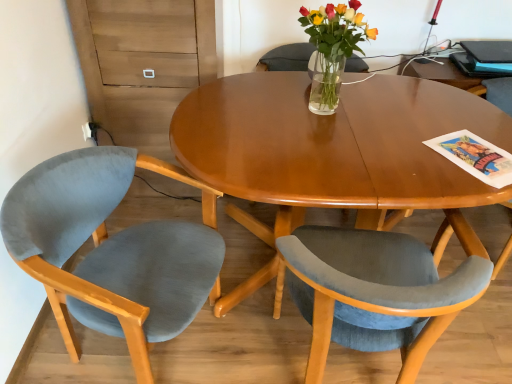
Question: Based on their sizes in the image, would you say velvet blue chair at center, which appears as the second chair when viewed from the left, is bigger or smaller than blue glossy magazine at upper right?

Choices:
 (A) small
 (B) big

Answer: (B)

Question: Is velvet blue chair at center, which ranks as the second chair in right-to-left order, inside the boundaries of blue glossy magazine at upper right, or outside?

Choices:
 (A) inside
 (B) outside

Answer: (B)

Question: Which is farther from the velvet blue chair at center, which ranks as the second chair in right-to-left order?

Choices:
 (A) velvet blue chair at left, the 3th chair in the right-to-left sequence
 (B) clear glass vase at center
 (C) blue glossy magazine at upper right
 (D) clear glass vase at center
 (E) velvet blue chair at right, placed as the 3th chair when sorted from left to right

Answer: (C)

Question: Estimate the real-world distances between objects in this image. Which object is farther from the velvet blue chair at left, which is the 1th chair from left to right?

Choices:
 (A) black plastic laptop at upper right
 (B) clear glass vase at center
 (C) velvet blue chair at right, which ranks as the first chair in right-to-left order
 (D) clear glass vase at center
 (E) velvet blue chair at center, which appears as the second chair when viewed from the left

Answer: (A)